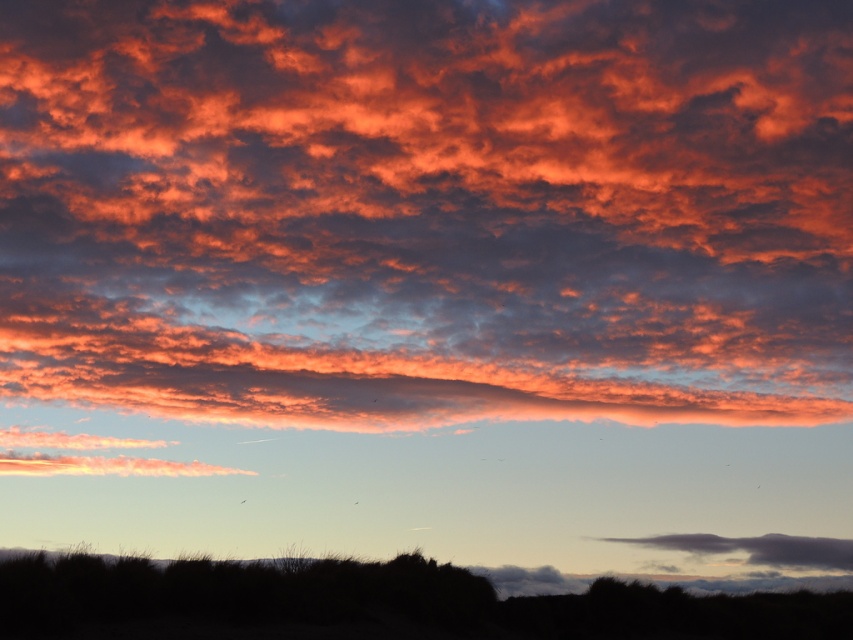
You are an astronomer trying to locate the cloudy sky at upper center in the sunset scene. Using the coordinates provided, can you confirm if the point at (427, 211) is within the cloudy sky area?

The point at (427, 211) is indeed within the cloudy sky at upper center as indicated by the coordinates.

You are an astronomer observing the sunset scene. You notice the cloudy sky at upper center and the silhouette grass at lower center. Which object is positioned higher in the sky?

The cloudy sky at upper center is positioned higher in the sky than the silhouette grass at lower center.